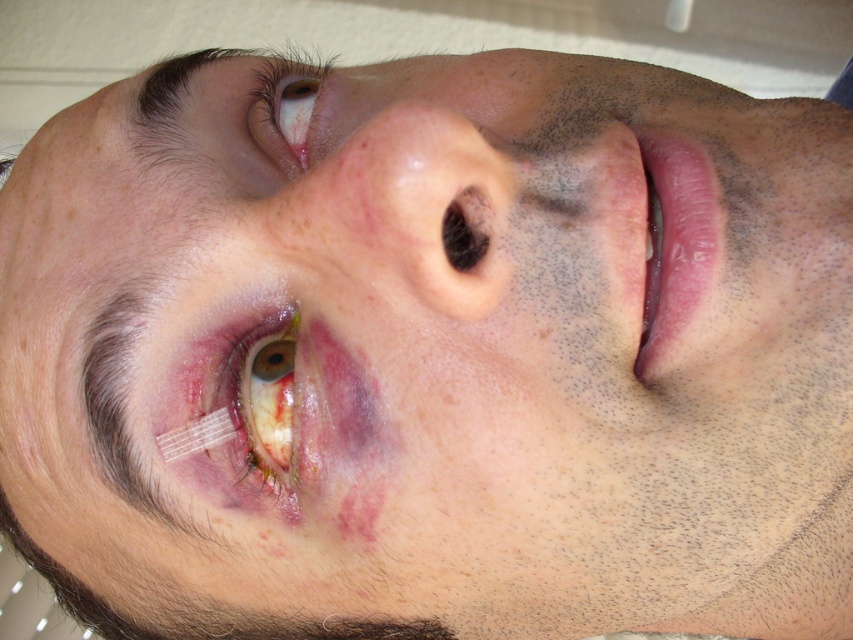
Is pink smooth lips at center taller than brown matte eye at upper left?

Indeed, pink smooth lips at center has a greater height compared to brown matte eye at upper left.

Which is more to the left, pink smooth lips at center or brown matte eye at upper left?

From the viewer's perspective, brown matte eye at upper left appears more on the left side.

Which is in front, point (657, 205) or point (312, 74)?

Positioned in front is point (657, 205).

At what (x,y) coordinates should I click in order to perform the action: click on pink smooth lips at center. Please return your answer as a coordinate pair (x, y). This screenshot has height=640, width=853. Looking at the image, I should click on (675, 248).

Is point (154, 150) positioned behind point (252, 461)?

Yes, point (154, 150) is behind point (252, 461).

Can you confirm if brown hair at upper left is taller than swollen skin at lower left?

→ Incorrect, brown hair at upper left's height is not larger of swollen skin at lower left's.

Is point (173, 152) positioned behind point (263, 448)?

Yes, it is behind point (263, 448).

Where is `brown hair at upper left`? The width and height of the screenshot is (853, 640). brown hair at upper left is located at coordinates (241, 88).

Is pink smooth lips at center below swollen skin at lower left?

Actually, pink smooth lips at center is above swollen skin at lower left.

Between point (689, 200) and point (263, 340), which one is positioned behind?

The point (263, 340) is behind.

Where is `pink smooth lips at center`? The image size is (853, 640). pink smooth lips at center is located at coordinates (675, 248).

Locate an element on the screen. pink smooth lips at center is located at coordinates (675, 248).